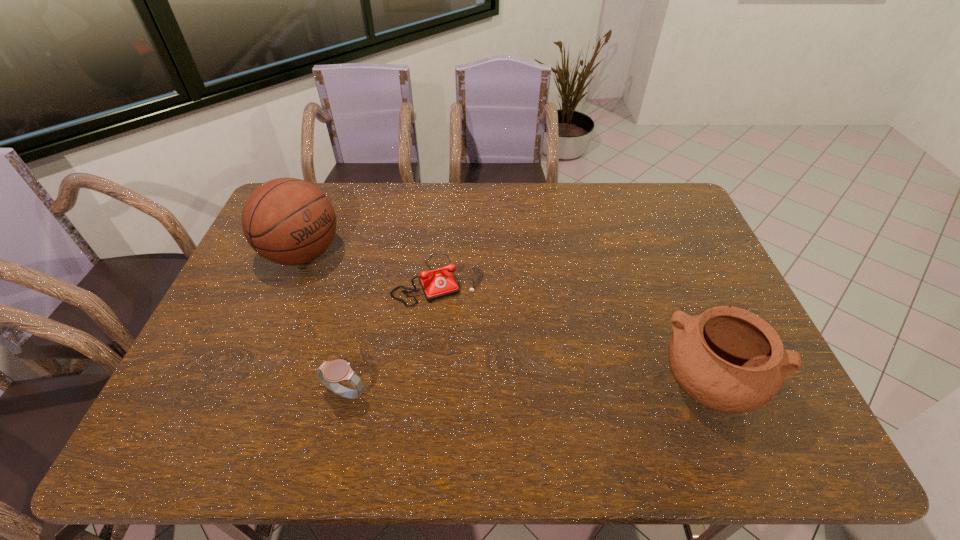
Where is `watch`? watch is located at coordinates point(330,373).

Find the location of a particular element. This screenshot has height=540, width=960. the third object from right to left is located at coordinates (330, 373).

The height and width of the screenshot is (540, 960). I want to click on the rightmost object, so click(x=728, y=359).

I want to click on the second tallest object, so click(x=728, y=359).

The height and width of the screenshot is (540, 960). What are the coordinates of `the shortest object` in the screenshot? It's located at point(436,284).

I want to click on the second object from right to left, so click(x=436, y=284).

Identify the location of the tallest object. The width and height of the screenshot is (960, 540). (288, 221).

Where is `the leftmost object`? the leftmost object is located at coordinates (288, 221).

The width and height of the screenshot is (960, 540). I want to click on blank space located 0.070m on the back of the second shortest object, so click(x=354, y=357).

Identify the location of vacant area situated on the back of the pottery. (681, 313).